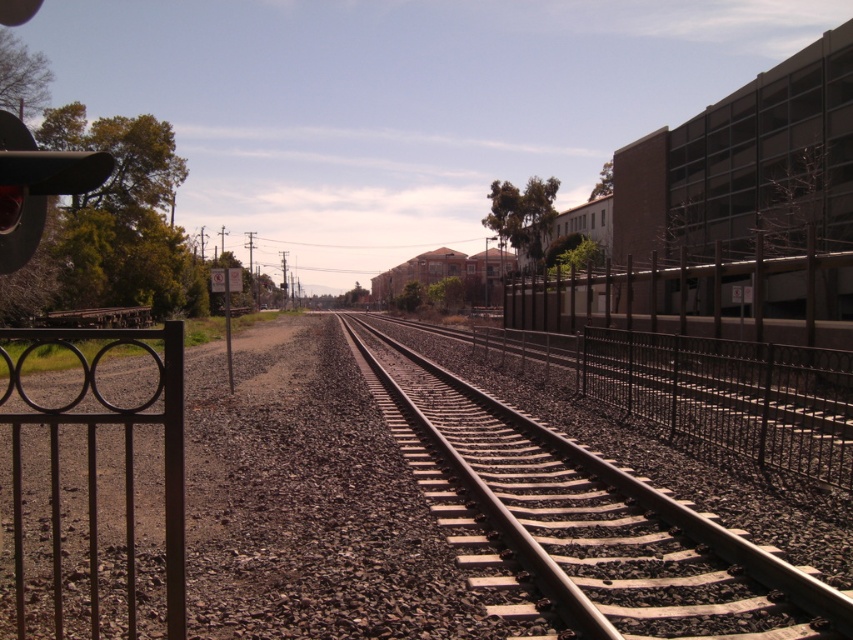
Which is below, smooth metal track at center or brown wrought iron gate at left?

smooth metal track at center is below.

Where is `smooth metal track at center`? smooth metal track at center is located at coordinates (583, 522).

How distant is smooth metal track at center from brown metal fence at right?

41.74 feet

Which is more to the left, smooth metal track at center or brown metal fence at right?

Positioned to the left is smooth metal track at center.

Locate an element on the screen. This screenshot has width=853, height=640. smooth metal track at center is located at coordinates (583, 522).

Is brown metal fence at right bigger than brown wrought iron gate at left?

Yes, brown metal fence at right is bigger than brown wrought iron gate at left.

Is brown metal fence at right to the right of brown wrought iron gate at left from the viewer's perspective?

→ Indeed, brown metal fence at right is positioned on the right side of brown wrought iron gate at left.

Does point (811, 308) lie behind point (96, 420)?

Yes, point (811, 308) is behind point (96, 420).

Identify the location of brown metal fence at right. The image size is (853, 640). (677, 300).